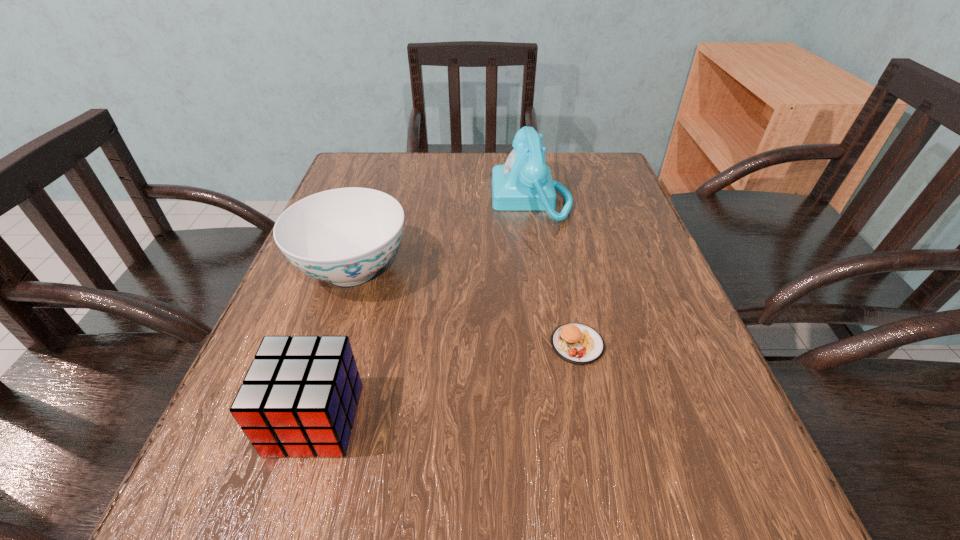
The image size is (960, 540). Find the location of `free space that satisfies the following two spatial constraints: 1. on the back side of the nearest object; 2. on the left side of the shortest object`. free space that satisfies the following two spatial constraints: 1. on the back side of the nearest object; 2. on the left side of the shortest object is located at coordinates (338, 345).